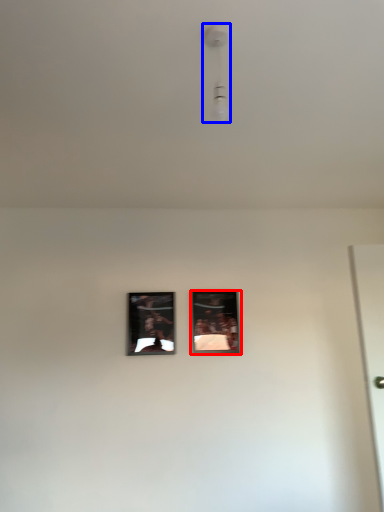
Question: Which object is further to the camera taking this photo, picture frame (highlighted by a red box) or light fixture (highlighted by a blue box)?

Choices:
 (A) picture frame
 (B) light fixture

Answer: (A)